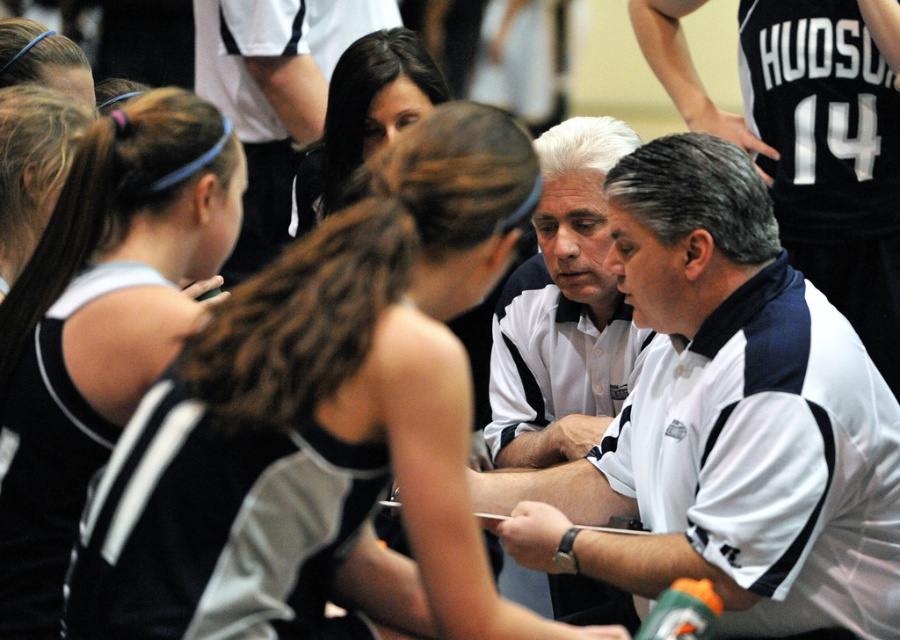
Looking at the scene of the sports team huddle, which object is smaller between the black jersey at left and the smooth brown hair at center?

The black jersey at left is smaller than the smooth brown hair at center.